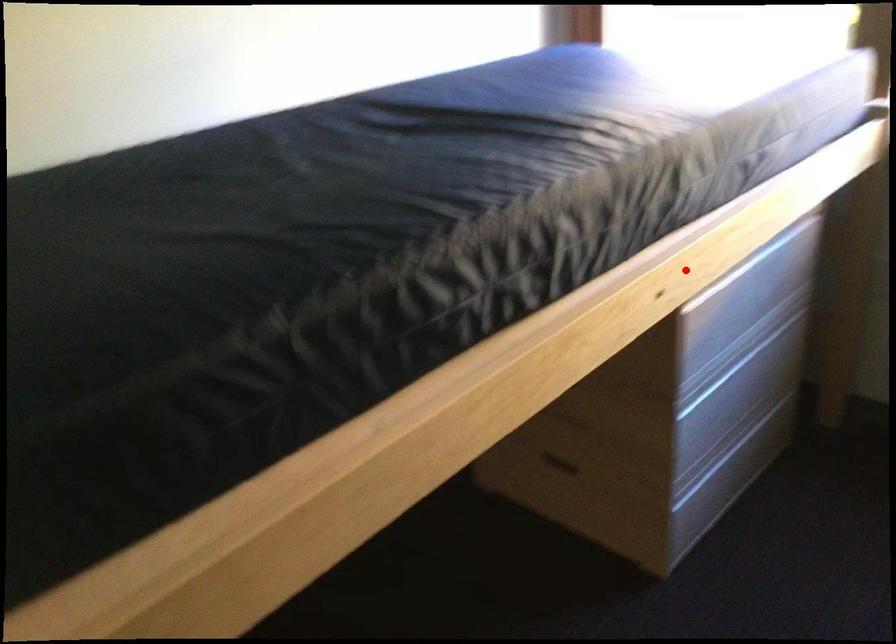
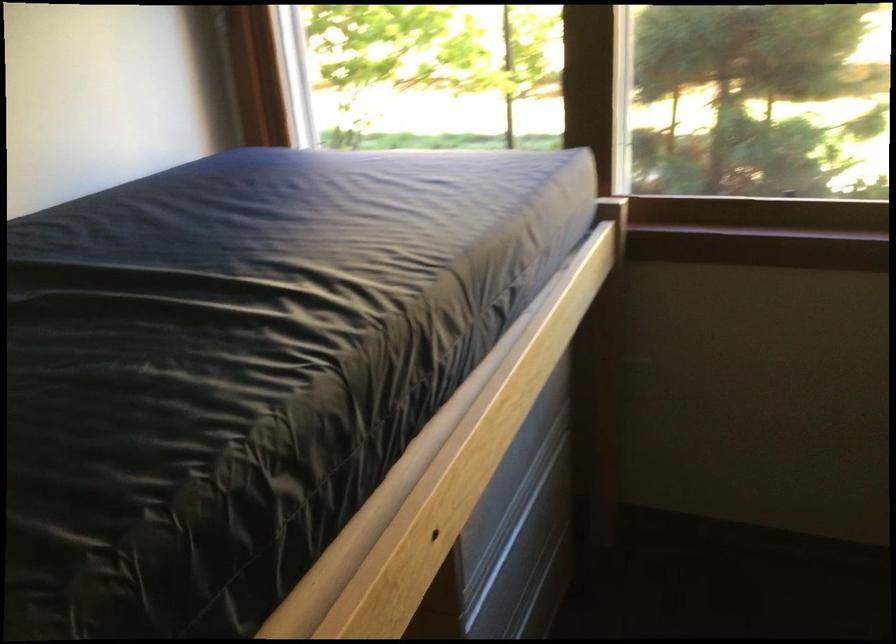
In the second image, find the point that corresponds to the highlighted location in the first image.

(467, 478)